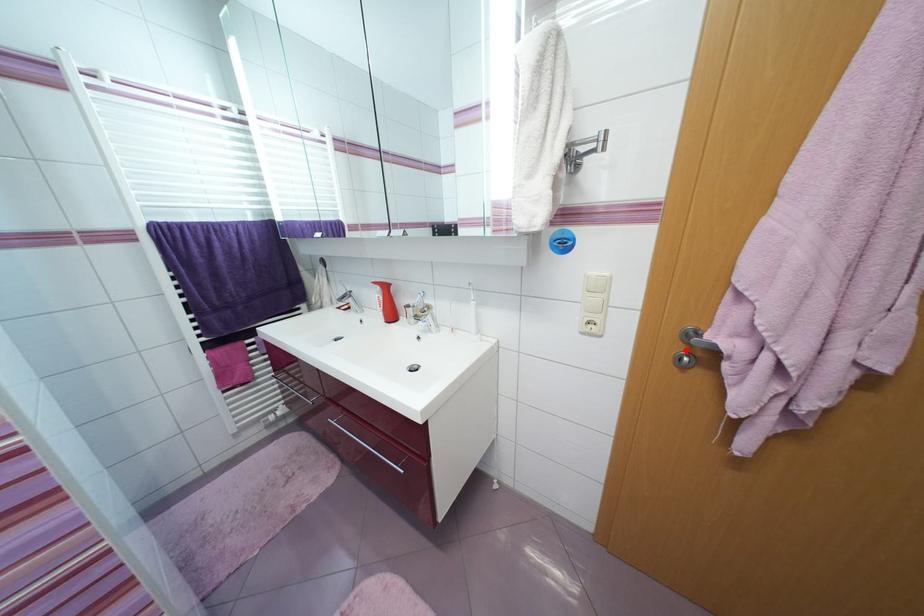
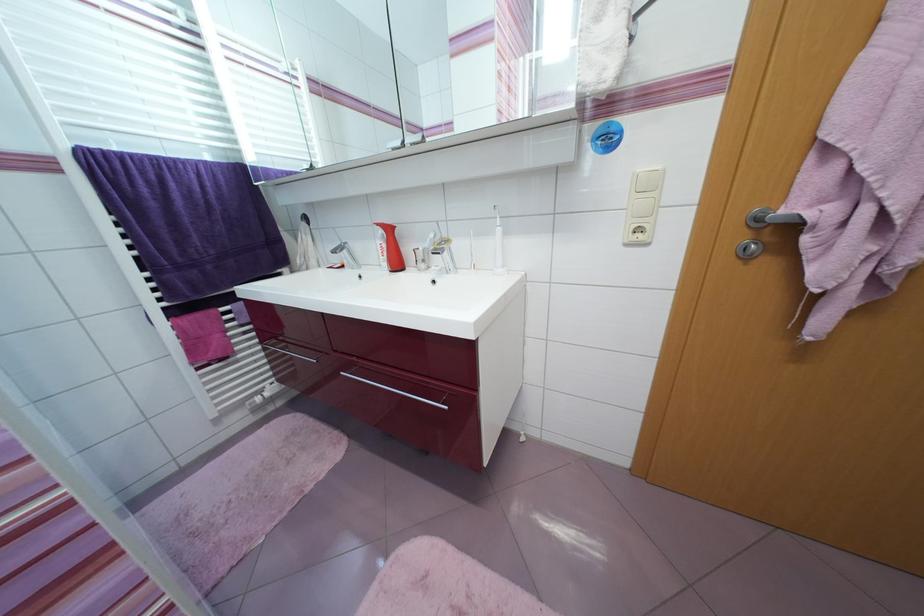
Find the pixel in the second image that matches the highlighted location in the first image.

(748, 238)